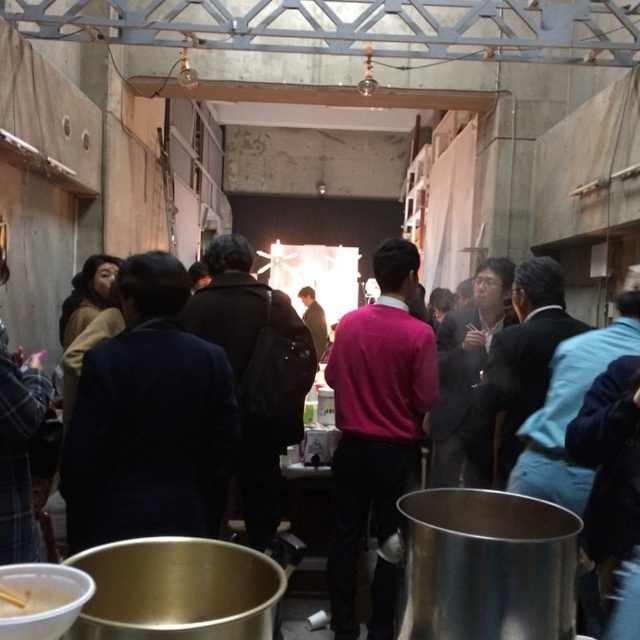
Question: Can you confirm if dark blue suit at center is wider than white matte bowl at lower left?

Choices:
 (A) no
 (B) yes

Answer: (B)

Question: Which of the following is the closest to the observer?

Choices:
 (A) dark blue suit at center
 (B) white matte bowl at lower left

Answer: (B)

Question: Is dark blue suit at center bigger than white matte bowl at lower left?

Choices:
 (A) no
 (B) yes

Answer: (B)

Question: Which object appears closest to the camera in this image?

Choices:
 (A) white matte bowl at lower left
 (B) dark blue suit at center

Answer: (A)

Question: Does dark blue suit at center come behind white matte bowl at lower left?

Choices:
 (A) yes
 (B) no

Answer: (A)